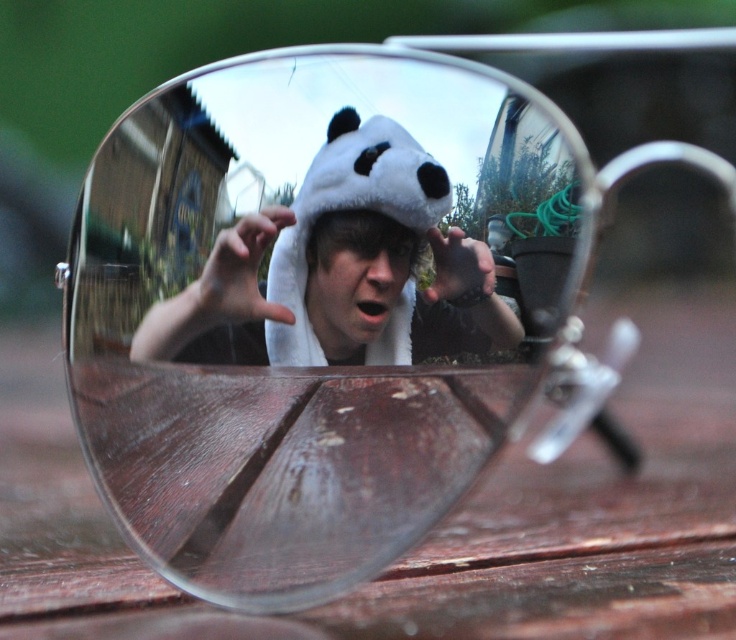
You are an interior designer organizing a playful themed event. You see the white plush panda hat at center and the white plush hat at center in the scene. Which one is positioned higher?

The white plush panda hat at center is located above the white plush hat at center, so it is positioned higher.

You are a photographer trying to capture the reflection of the white plush panda hat at center and the white plush hat at center in the sunglasses. The minimum distance required for a clear reflection is 1.5 inches. Can both objects be clearly reflected?

The white plush panda hat at center is only 1.34 inches from the white plush hat at center, which is less than the required 1.5 inches for a clear reflection. Therefore, both objects cannot be clearly reflected in the sunglasses.

You are holding a camera and want to take a closeup photo of the white plush panda hat at center. The camera lens has a minimum focusing distance of 18 inches. Can you take the photo without moving the hat?

The white plush panda hat at center is 20.57 inches away from the viewer. Since the camera lens can focus as close as 18 inches, you can take the closeup photo without moving the hat because the distance is within the lens capability.